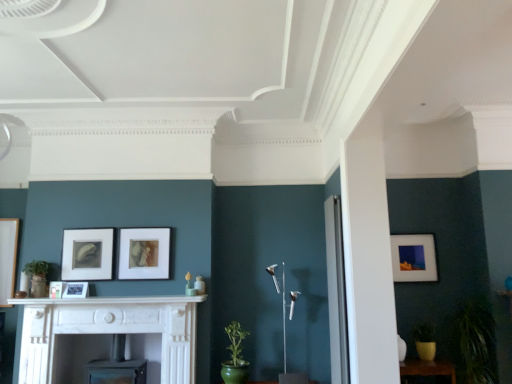
Image resolution: width=512 pixels, height=384 pixels. In order to click on green matte plant at lower right, the second plant from the left in this screenshot , I will do `click(474, 342)`.

Describe the element at coordinates (76, 290) in the screenshot. The image size is (512, 384). I see `matte black picture frame at center, the 4th picture frame from the right` at that location.

The image size is (512, 384). Describe the element at coordinates (236, 340) in the screenshot. I see `green glazed pot at lower center, placed as the 1th plant when sorted from left to right` at that location.

Describe the element at coordinates (56, 289) in the screenshot. The width and height of the screenshot is (512, 384). I see `matte black picture frame at center, which ranks as the fifth picture frame in right-to-left order` at that location.

The height and width of the screenshot is (384, 512). Identify the location of matte black picture frame at center, placed as the 1th picture frame when sorted from front to back. (56, 289).

Find the location of a particular element. This screenshot has width=512, height=384. matte white picture frame at right, positioned as the 1th picture frame in back-to-front order is located at coordinates (414, 258).

Is matte black picture frame at center, positioned as the first picture frame in left-to-right order, at the back of wooden table at lower right?

wooden table at lower right does not have its back to matte black picture frame at center, positioned as the first picture frame in left-to-right order.

Who is smaller, wooden table at lower right or matte black picture frame at center, placed as the 1th picture frame when sorted from front to back?

matte black picture frame at center, placed as the 1th picture frame when sorted from front to back, is smaller.

Is wooden table at lower right not close to matte black picture frame at center, positioned as the first picture frame in left-to-right order?

Absolutely, wooden table at lower right is distant from matte black picture frame at center, positioned as the first picture frame in left-to-right order.

Considering the sizes of objects wooden table at lower right and green matte plant at lower right, which ranks as the 1th plant in right-to-left order, in the image provided, who is thinner, wooden table at lower right or green matte plant at lower right, which ranks as the 1th plant in right-to-left order,?

wooden table at lower right is thinner.

Which is behind, wooden table at lower right or green matte plant at lower right, the second plant from the left?

wooden table at lower right.

Is wooden table at lower right oriented away from green matte plant at lower right, which ranks as the 1th plant in right-to-left order?

No, wooden table at lower right's orientation is not away from green matte plant at lower right, which ranks as the 1th plant in right-to-left order.

Could you measure the distance between wooden table at lower right and green matte plant at lower right, which ranks as the 1th plant in right-to-left order?

wooden table at lower right is 14.84 inches from green matte plant at lower right, which ranks as the 1th plant in right-to-left order.

Would you consider matte brown picture frame at center, placed as the 2th picture frame when sorted from right to left, to be distant from matte black picture frame at center left, the third picture frame positioned from the right?

No, matte brown picture frame at center, placed as the 2th picture frame when sorted from right to left, is in close proximity to matte black picture frame at center left, the third picture frame positioned from the right.

From a real-world perspective, is matte brown picture frame at center, which is counted as the 4th picture frame, starting from the left, positioned under matte black picture frame at center left, the third picture frame viewed from the left, based on gravity?

No, from a real-world perspective, matte brown picture frame at center, which is counted as the 4th picture frame, starting from the left, is not below matte black picture frame at center left, the third picture frame viewed from the left.

Does matte brown picture frame at center, placed as the third picture frame when sorted from front to back, have a smaller size compared to matte black picture frame at center left, arranged as the 2th picture frame when viewed from the back?

Incorrect, matte brown picture frame at center, placed as the third picture frame when sorted from front to back, is not smaller in size than matte black picture frame at center left, arranged as the 2th picture frame when viewed from the back.

From the picture: Who is smaller, matte brown picture frame at center, which is the third picture frame in back-to-front order, or matte white picture frame at right, the fifth picture frame when ordered from front to back?

With smaller size is matte white picture frame at right, the fifth picture frame when ordered from front to back.

From their relative heights in the image, would you say matte brown picture frame at center, which is the third picture frame in back-to-front order, is taller or shorter than matte white picture frame at right, the fifth picture frame when ordered from front to back?

Clearly, matte brown picture frame at center, which is the third picture frame in back-to-front order, is shorter compared to matte white picture frame at right, the fifth picture frame when ordered from front to back.

Is matte brown picture frame at center, placed as the 2th picture frame when sorted from right to left, at the right side of matte white picture frame at right, the first picture frame from the right?

No, matte brown picture frame at center, placed as the 2th picture frame when sorted from right to left, is not to the right of matte white picture frame at right, the first picture frame from the right.

From a real-world perspective, is matte brown picture frame at center, placed as the 2th picture frame when sorted from right to left, physically below matte white picture frame at right, the fifth picture frame when ordered from front to back?

No, from a real-world perspective, matte brown picture frame at center, placed as the 2th picture frame when sorted from right to left, is not under matte white picture frame at right, the fifth picture frame when ordered from front to back.

Based on the photo, is matte black picture frame at center left, positioned as the 4th picture frame in front-to-back order, directly adjacent to matte brown picture frame at center, which is the third picture frame in back-to-front order?

They are not placed beside each other.

Is point (66, 259) in front of point (133, 240)?

Yes, it is.

Would you say matte black picture frame at center left, the third picture frame positioned from the right, is outside matte brown picture frame at center, placed as the third picture frame when sorted from front to back?

Absolutely, matte black picture frame at center left, the third picture frame positioned from the right, is external to matte brown picture frame at center, placed as the third picture frame when sorted from front to back.

Is point (234, 331) positioned in front of point (421, 371)?

No, it is behind (421, 371).

Considering the sizes of objects green glazed pot at lower center, placed as the 1th plant when sorted from left to right, and wooden table at lower right in the image provided, who is thinner, green glazed pot at lower center, placed as the 1th plant when sorted from left to right, or wooden table at lower right?

green glazed pot at lower center, placed as the 1th plant when sorted from left to right, is thinner.

Is green glazed pot at lower center, marked as the 2th plant in a right-to-left arrangement, oriented towards wooden table at lower right?

No, green glazed pot at lower center, marked as the 2th plant in a right-to-left arrangement, is not facing towards wooden table at lower right.

Are green glazed pot at lower center, marked as the 2th plant in a right-to-left arrangement, and wooden table at lower right far apart?

Absolutely, green glazed pot at lower center, marked as the 2th plant in a right-to-left arrangement, is distant from wooden table at lower right.

From the image's perspective, is matte white picture frame at right, the fifth picture frame when ordered from front to back, beneath white marble fireplace at lower left?

No, from the image's perspective, matte white picture frame at right, the fifth picture frame when ordered from front to back, is not below white marble fireplace at lower left.

Does matte white picture frame at right, positioned as the 1th picture frame in back-to-front order, turn towards white marble fireplace at lower left?

No, matte white picture frame at right, positioned as the 1th picture frame in back-to-front order, is not oriented towards white marble fireplace at lower left.

Does point (423, 237) come farther from viewer compared to point (48, 368)?

Yes.

Considering the sizes of objects matte white picture frame at right, the first picture frame from the right, and white marble fireplace at lower left in the image provided, who is taller, matte white picture frame at right, the first picture frame from the right, or white marble fireplace at lower left?

white marble fireplace at lower left is taller.

The height and width of the screenshot is (384, 512). I want to click on the 2nd picture frame above when counting from the wooden table at lower right (from the image's perspective), so click(x=56, y=289).

You are a GUI agent. You are given a task and a screenshot of the screen. Output one action in this format:
    pyautogui.click(x=<x>, y=<y>)
    Task: Click on the plant in front of the wooden table at lower right
    
    Given the screenshot: What is the action you would take?
    pyautogui.click(x=474, y=342)

When comparing their distances from green matte plant at lower right, which ranks as the 1th plant in right-to-left order, does matte black picture frame at center, positioned as the first picture frame in left-to-right order, or matte black picture frame at center, arranged as the 4th picture frame when viewed from the back, seem further?

Among the two, matte black picture frame at center, positioned as the first picture frame in left-to-right order, is located further to green matte plant at lower right, which ranks as the 1th plant in right-to-left order.

Which object lies further to the anchor point wooden table at lower right, green matte plant at lower right, the second plant from the left, or matte black picture frame at center, positioned as the first picture frame in left-to-right order?

The object further to wooden table at lower right is matte black picture frame at center, positioned as the first picture frame in left-to-right order.

Consider the image. From the image, which object appears to be nearer to wooden table at lower right, white marble mantle at center or green matte plant at lower right, the second plant from the left?

Based on the image, green matte plant at lower right, the second plant from the left, appears to be nearer to wooden table at lower right.

Estimate the real-world distances between objects in this image. Which object is closer to white marble fireplace at lower left, white marble mantle at center or matte black picture frame at center, arranged as the 4th picture frame when viewed from the back?

white marble mantle at center lies closer to white marble fireplace at lower left than the other object.

From the image, which object appears to be nearer to matte black picture frame at center left, positioned as the 4th picture frame in front-to-back order, matte black picture frame at center, the 4th picture frame from the right, or matte black picture frame at center, positioned as the first picture frame in left-to-right order?

matte black picture frame at center, the 4th picture frame from the right, is positioned closer to the anchor matte black picture frame at center left, positioned as the 4th picture frame in front-to-back order.

Based on their spatial positions, is matte brown picture frame at center, which is the third picture frame in back-to-front order, or green glazed pot at lower center, placed as the 1th plant when sorted from left to right, further from white marble fireplace at lower left?

Among the two, green glazed pot at lower center, placed as the 1th plant when sorted from left to right, is located further to white marble fireplace at lower left.

Based on their spatial positions, is matte black picture frame at center left, the third picture frame viewed from the left, or green matte plant at lower right, the second plant from the left, further from white marble fireplace at lower left?

Among the two, green matte plant at lower right, the second plant from the left, is located further to white marble fireplace at lower left.

Which object lies further to the anchor point matte black picture frame at center, positioned as the second picture frame in left-to-right order, matte white picture frame at right, the first picture frame from the right, or green matte plant at lower right, the second plant from the left?

The object further to matte black picture frame at center, positioned as the second picture frame in left-to-right order, is green matte plant at lower right, the second plant from the left.

This screenshot has height=384, width=512. I want to click on mantle situated between matte black picture frame at center, arranged as the 4th picture frame when viewed from the back, and matte brown picture frame at center, placed as the 2th picture frame when sorted from right to left, from left to right, so click(109, 300).

Identify the location of plant between matte black picture frame at center left, positioned as the 4th picture frame in front-to-back order, and wooden table at lower right. (236, 340).

This screenshot has width=512, height=384. What are the coordinates of `plant between matte black picture frame at center, positioned as the second picture frame in left-to-right order, and matte white picture frame at right, positioned as the 1th picture frame in back-to-front order, in the horizontal direction` in the screenshot? It's located at (236, 340).

I want to click on mantle between matte black picture frame at center, marked as the fifth picture frame in a back-to-front arrangement, and matte white picture frame at right, the fifth picture frame viewed from the left, so click(x=109, y=300).